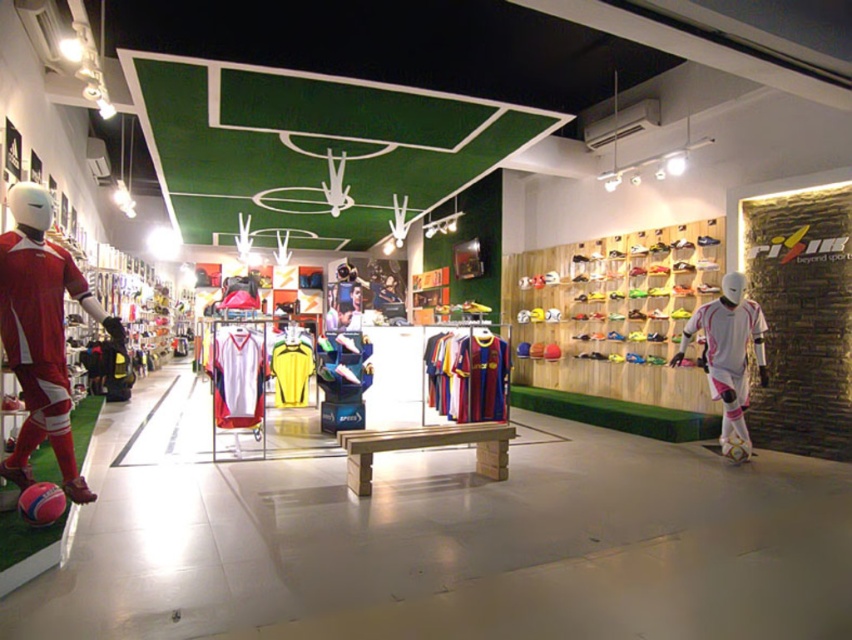
You are a customer in the sports store looking at the green wall with the soccer field layout. You notice a point marked at coordinates [39,333]. What object is located at that point?

The object at point [39,333] is the matte red soccer uniform at left.

You are a customer in the sports store looking at the matte red soccer uniform at left and the white matte soccer player at right. Which object is positioned higher in the image?

The matte red soccer uniform at left is positioned higher than the white matte soccer player at right.

You are a soccer coach who wants to arrange your team members in a straight line formation between the matte red soccer uniform at left and the white matte soccer player at right. Each player needs at least 1 meter of space between them. How many players can you fit in this line?

The distance between the matte red soccer uniform at left and the white matte soccer player at right is 5.16 meters. Since each player requires 1 meter of space, you can fit 5 players in the line, as 5 meters would be needed for 5 players with 1 meter between each, leaving 0.16 meters unused.